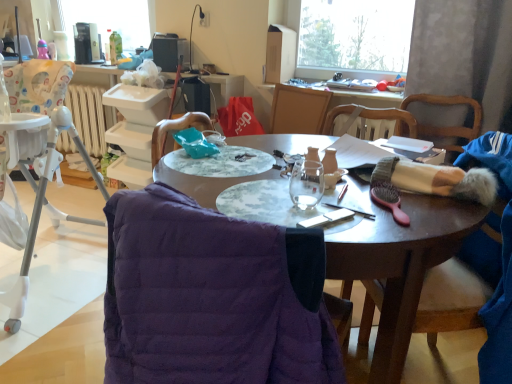
This screenshot has width=512, height=384. In order to click on free space behind silver metallic phone at center in this screenshot , I will do `click(316, 196)`.